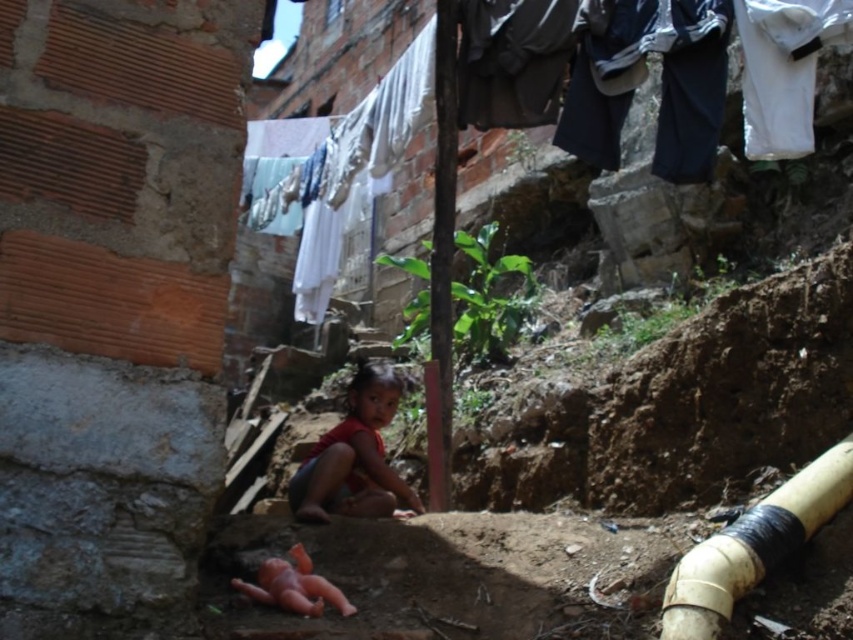
Question: Which point is closer to the camera?

Choices:
 (A) red matte dress at center
 (B) yellow matte water pipe at lower right

Answer: (B)

Question: Which point is farther from the camera taking this photo?

Choices:
 (A) (691, 593)
 (B) (299, 513)

Answer: (B)

Question: Among these points, which one is farthest from the camera?

Choices:
 (A) (820, 497)
 (B) (358, 392)

Answer: (B)

Question: Can you confirm if yellow matte water pipe at lower right is smaller than red matte dress at center?

Choices:
 (A) yes
 (B) no

Answer: (A)

Question: Is the position of yellow matte water pipe at lower right less distant than that of red matte dress at center?

Choices:
 (A) yes
 (B) no

Answer: (A)

Question: Can you confirm if yellow matte water pipe at lower right is bigger than red matte dress at center?

Choices:
 (A) yes
 (B) no

Answer: (B)